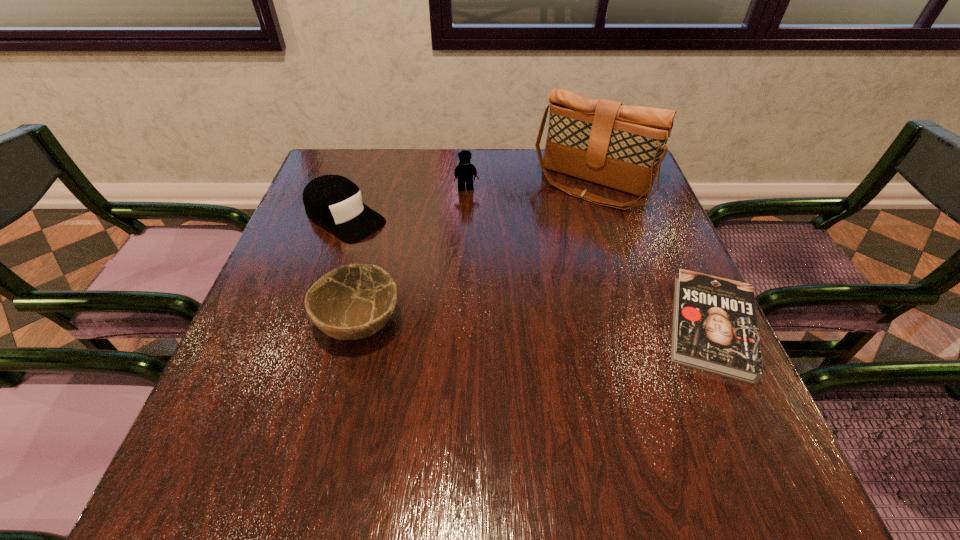
Locate an element on the screen. This screenshot has width=960, height=540. object present at the near edge is located at coordinates (715, 329).

You are a GUI agent. You are given a task and a screenshot of the screen. Output one action in this format:
    pyautogui.click(x=<x>, y=<y>)
    Task: Click on the bowl present at the left edge
    Image resolution: width=960 pixels, height=540 pixels.
    Given the screenshot: What is the action you would take?
    pyautogui.click(x=352, y=302)

At what (x,y) coordinates should I click in order to perform the action: click on cap located at the left edge. Please return your answer as a coordinate pair (x, y). Looking at the image, I should click on click(334, 202).

The height and width of the screenshot is (540, 960). Find the location of `book present at the right edge`. book present at the right edge is located at coordinates (715, 329).

You are a GUI agent. You are given a task and a screenshot of the screen. Output one action in this format:
    pyautogui.click(x=<x>, y=<y>)
    Task: Click on the shoulder bag that is at the right edge
    The width and height of the screenshot is (960, 540).
    Given the screenshot: What is the action you would take?
    pyautogui.click(x=601, y=141)

The width and height of the screenshot is (960, 540). I want to click on object present at the far left corner, so click(x=334, y=202).

Identify the location of object at the far right corner. Image resolution: width=960 pixels, height=540 pixels. (601, 141).

This screenshot has height=540, width=960. Identify the location of object present at the near right corner. (715, 329).

The image size is (960, 540). In the image, there is a desktop. In order to click on free space at the far edge in this screenshot , I will do `click(412, 173)`.

The height and width of the screenshot is (540, 960). What are the coordinates of `vacant space at the near edge` in the screenshot? It's located at (477, 426).